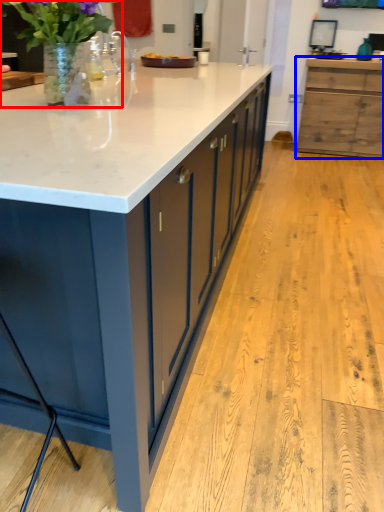
Question: Which object appears closest to the camera in this image, houseplant (highlighted by a red box) or cabinetry (highlighted by a blue box)?

Choices:
 (A) houseplant
 (B) cabinetry

Answer: (A)